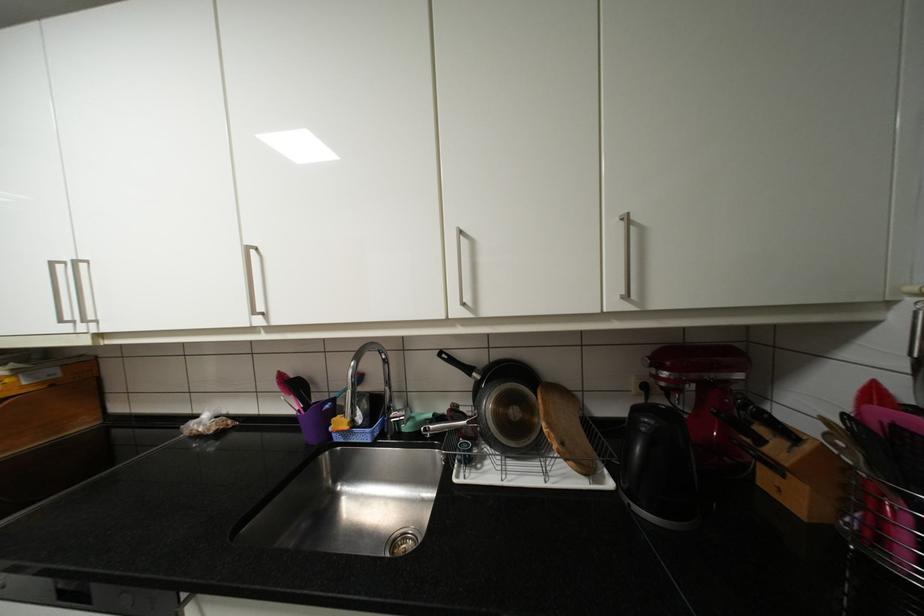
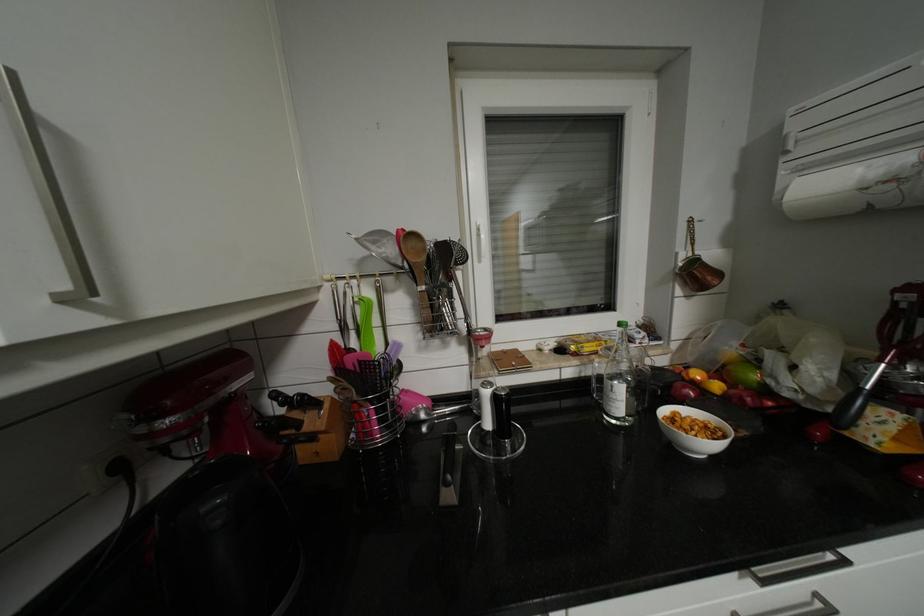
Question: The camera is either moving clockwise (left) or counter-clockwise (right) around the object. The first image is from the beginning of the video and the second image is from the end. Is the camera moving left or right when shooting the video?

Choices:
 (A) Left
 (B) Right

Answer: (A)